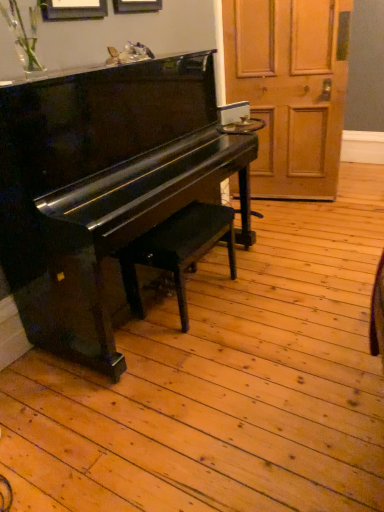
In order to click on free space above matte black bench at center (from a real-world perspective) in this screenshot , I will do `click(184, 219)`.